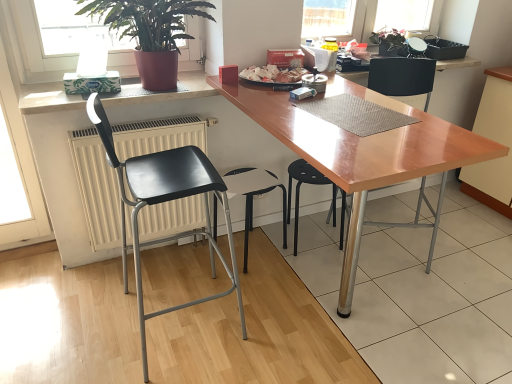
Question: Does light wood cabinet at lower right have a lesser width compared to black plastic stool at center, placed as the second chair when sorted from right to left?

Choices:
 (A) no
 (B) yes

Answer: (A)

Question: Is light wood cabinet at lower right oriented towards black plastic stool at center, the 3th chair in the left-to-right sequence?

Choices:
 (A) no
 (B) yes

Answer: (B)

Question: Considering the relative sizes of light wood cabinet at lower right and black plastic stool at center, the 3th chair in the left-to-right sequence, in the image provided, is light wood cabinet at lower right bigger than black plastic stool at center, the 3th chair in the left-to-right sequence,?

Choices:
 (A) no
 (B) yes

Answer: (B)

Question: From a real-world perspective, is light wood cabinet at lower right physically above black plastic stool at center, the 3th chair in the left-to-right sequence?

Choices:
 (A) yes
 (B) no

Answer: (A)

Question: Is light wood cabinet at lower right closer to camera compared to black plastic stool at center, the 3th chair in the left-to-right sequence?

Choices:
 (A) no
 (B) yes

Answer: (A)

Question: Considering the positions of point (494, 200) and point (280, 74), is point (494, 200) closer or farther from the camera than point (280, 74)?

Choices:
 (A) closer
 (B) farther

Answer: (B)

Question: Looking at the image, does light wood cabinet at lower right seem bigger or smaller compared to white glossy plate at center?

Choices:
 (A) big
 (B) small

Answer: (A)

Question: Which is correct: light wood cabinet at lower right is inside white glossy plate at center, or outside of it?

Choices:
 (A) outside
 (B) inside

Answer: (A)

Question: From the image's perspective, is light wood cabinet at lower right above or below white glossy plate at center?

Choices:
 (A) below
 (B) above

Answer: (A)

Question: Is wooden table at center wider or thinner than matte black chair at center, which is counted as the 1th chair, starting from the right?

Choices:
 (A) wide
 (B) thin

Answer: (A)

Question: In the image, is wooden table at center on the left side or the right side of matte black chair at center, which is counted as the 1th chair, starting from the right?

Choices:
 (A) right
 (B) left

Answer: (B)

Question: From the image's perspective, is wooden table at center positioned above or below matte black chair at center, which is counted as the 1th chair, starting from the right?

Choices:
 (A) above
 (B) below

Answer: (B)

Question: Does point (258, 94) appear closer or farther from the camera than point (375, 69)?

Choices:
 (A) closer
 (B) farther

Answer: (A)

Question: From a real-world perspective, is white matte radiator at left physically located above or below black plastic stool at center, positioned as the third chair in right-to-left order?

Choices:
 (A) below
 (B) above

Answer: (B)

Question: Considering their positions, is white matte radiator at left located in front of or behind black plastic stool at center, positioned as the 2th chair in left-to-right order?

Choices:
 (A) behind
 (B) front

Answer: (B)